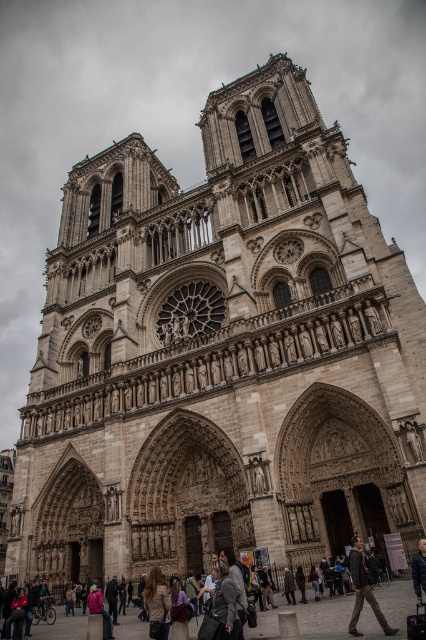
Question: Does dark gray fabric jacket at lower right have a larger size compared to dark blue leather jacket at center?

Choices:
 (A) yes
 (B) no

Answer: (A)

Question: Which of the following is the closest to the observer?

Choices:
 (A) (425, 577)
 (B) (385, 627)

Answer: (B)

Question: Which of the following is the farthest from the observer?

Choices:
 (A) dark gray fabric jacket at lower right
 (B) dark blue leather jacket at center

Answer: (B)

Question: From the image, what is the correct spatial relationship of dark gray fabric jacket at lower right in relation to dark blue leather jacket at center?

Choices:
 (A) right
 (B) left

Answer: (B)

Question: Does dark gray fabric jacket at lower right appear over dark blue leather jacket at center?

Choices:
 (A) no
 (B) yes

Answer: (B)

Question: Which of the following is the closest to the observer?

Choices:
 (A) (417, 563)
 (B) (362, 586)

Answer: (B)